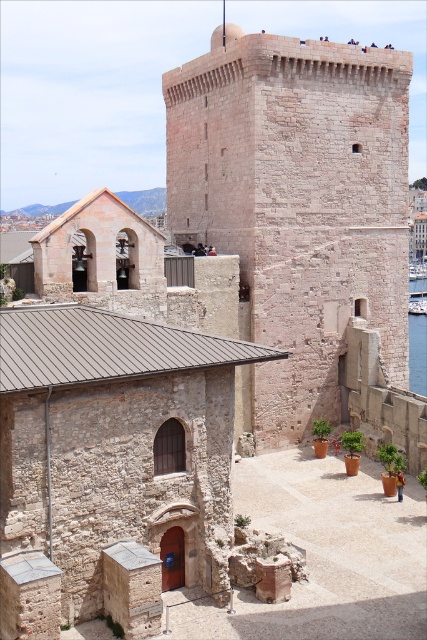
Consider the image. You are standing at the waterfront and want to take a photo of the rustic stone tower at center. If your camera can focus on objects up to 200 feet away, will you be able to capture the tower clearly?

The rustic stone tower at center is 159.50 feet away from the camera. Since 159.50 feet is less than 200 feet, the camera can focus on the tower, allowing you to capture it clearly.

Consider the image. You are a tourist standing in front of the historic stone structure. You notice the rustic stone tower at center and the clear blue water at right. Which object is higher in elevation?

The rustic stone tower at center is taller than the clear blue water at right, so the rustic stone tower at center is higher in elevation.